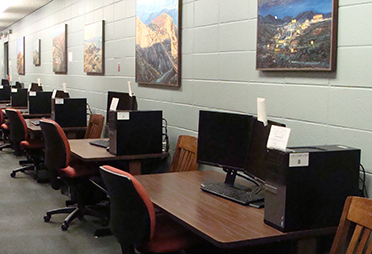
At what (x,y) coordinates should I click in order to perform the action: click on computer chair. Please return your answer as a coordinate pair (x, y). This screenshot has height=254, width=372. Looking at the image, I should click on (125, 184), (64, 137), (23, 134).